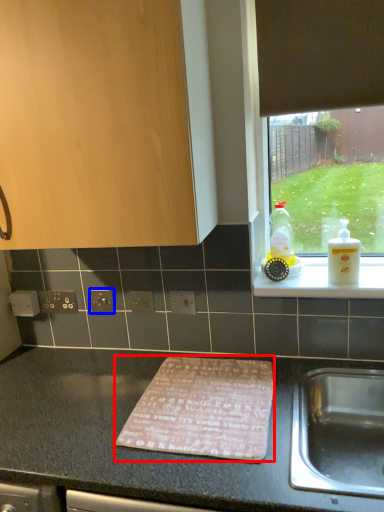
Question: Which object appears farthest to the camera in this image, mat (highlighted by a red box) or electric outlet (highlighted by a blue box)?

Choices:
 (A) mat
 (B) electric outlet

Answer: (B)